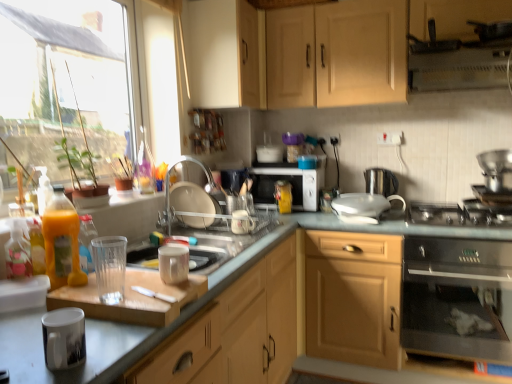
Question: Does translucent plastic bottle at left, arranged as the 3th bottle when viewed from the right, have a lesser width compared to white glossy plate at center, which is the 3th appliance from left to right?

Choices:
 (A) yes
 (B) no

Answer: (A)

Question: Considering the relative sizes of translucent plastic bottle at left, which appears as the 1th bottle when viewed from the front, and white glossy plate at center, which is the 3th appliance from back to front, in the image provided, is translucent plastic bottle at left, which appears as the 1th bottle when viewed from the front, taller than white glossy plate at center, which is the 3th appliance from back to front,?

Choices:
 (A) yes
 (B) no

Answer: (A)

Question: Is translucent plastic bottle at left, which appears as the 1th bottle when viewed from the front, oriented away from white glossy plate at center, which is the 3th appliance from back to front?

Choices:
 (A) no
 (B) yes

Answer: (A)

Question: From the image's perspective, is translucent plastic bottle at left, which appears as the 1th bottle when viewed from the front, located above white glossy plate at center, which is the 3th appliance from left to right?

Choices:
 (A) no
 (B) yes

Answer: (A)

Question: Is translucent plastic bottle at left, arranged as the 3th bottle when viewed from the right, smaller than white glossy plate at center, which is the 3th appliance from back to front?

Choices:
 (A) no
 (B) yes

Answer: (B)

Question: From a real-world perspective, is translucent plastic bottle at left, arranged as the 3th bottle when viewed from the right, on white glossy plate at center, which is the 3th appliance from back to front?

Choices:
 (A) no
 (B) yes

Answer: (B)

Question: Is translucent plastic bottle at left, which appears as the 1th bottle when viewed from the front, not near white matte cabinet at upper center, which appears as the second cabinetry when ordered from the bottom?

Choices:
 (A) no
 (B) yes

Answer: (B)

Question: Does translucent plastic bottle at left, which appears as the 1th bottle when viewed from the front, appear on the left side of white matte cabinet at upper center, the second cabinetry viewed from the top?

Choices:
 (A) yes
 (B) no

Answer: (A)

Question: Can you confirm if translucent plastic bottle at left, arranged as the 3th bottle when viewed from the right, is wider than white matte cabinet at upper center, the second cabinetry viewed from the top?

Choices:
 (A) yes
 (B) no

Answer: (B)

Question: Considering the relative sizes of translucent plastic bottle at left, which appears as the 1th bottle when viewed from the front, and white matte cabinet at upper center, the second cabinetry viewed from the top, in the image provided, is translucent plastic bottle at left, which appears as the 1th bottle when viewed from the front, thinner than white matte cabinet at upper center, the second cabinetry viewed from the top,?

Choices:
 (A) no
 (B) yes

Answer: (B)

Question: Is translucent plastic bottle at left, which appears as the 1th bottle when viewed from the front, positioned behind white matte cabinet at upper center, which appears as the second cabinetry when ordered from the bottom?

Choices:
 (A) no
 (B) yes

Answer: (A)

Question: Could you tell me if translucent plastic bottle at left, positioned as the 3th bottle in back-to-front order, is facing white matte cabinet at upper center, which appears as the second cabinetry when ordered from the bottom?

Choices:
 (A) no
 (B) yes

Answer: (A)

Question: Does matte wood cabinet at center, which is counted as the 3th cabinetry, starting from the top, appear on the right side of translucent plastic bottle at center, which is counted as the third bottle, starting from the left?

Choices:
 (A) yes
 (B) no

Answer: (A)